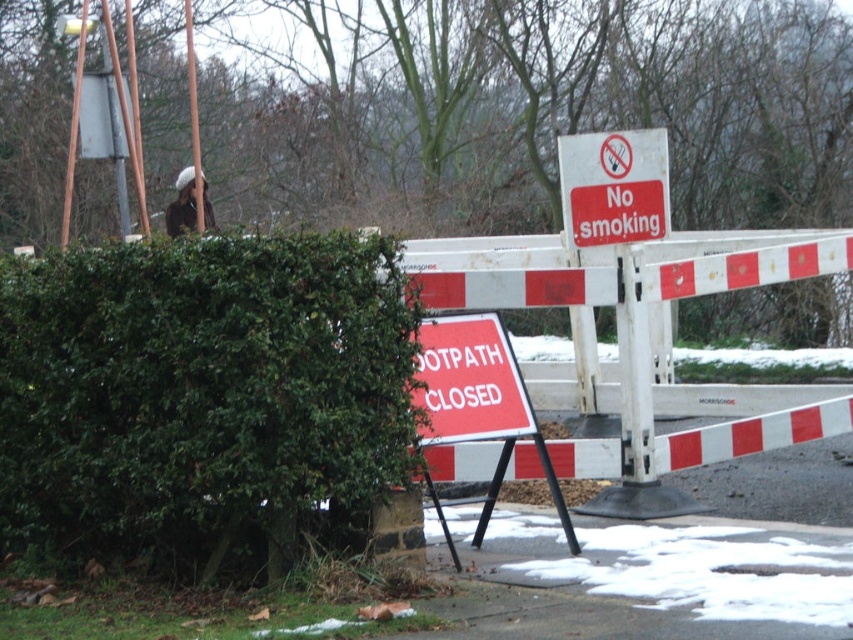
You are a delivery drone trying to navigate around the closed footpath. You must fly from the point at coordinates point (664, 212) to the point at coordinates point (196, 156). According to the scene description, which point is closer to the observer, and thus the first point you should pass over?

Point (664, 212) is in front of point (196, 156), so the delivery drone should first pass over point (664, 212) as it is closer to the observer.

You are a delivery robot that is 1.5 meters wide. You need to navigate around the green leafy hedge at left and the red plastic sign at upper center. Can you pass through the space between them?

The green leafy hedge at left and the red plastic sign at upper center are 2.77 meters apart from each other. Since the robot is 1.5 meters wide, it can pass through the space between them as the distance is greater than the robot width.

You are a delivery robot with a 1 meter wide package. You need to navigate through the path between the green leafy hedge at left and the red plastic sign at center. Can you fit through the space between them?

The distance between the green leafy hedge at left and the red plastic sign at center is 97.90 centimeters. Since your package is 1 meter wide, it is slightly wider than the available space, so you cannot fit through the path between them.